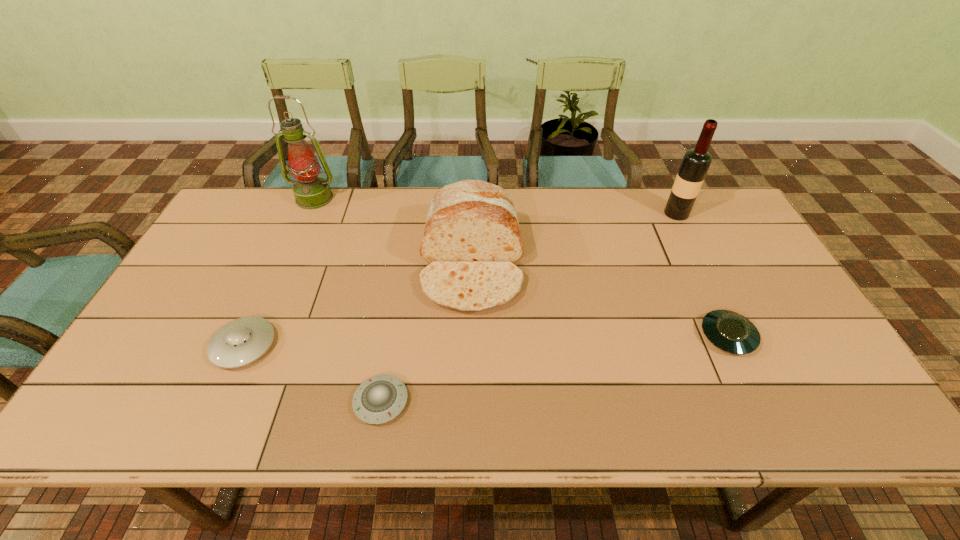
This screenshot has width=960, height=540. Find the location of `vacant space situated on the left of the leftmost saucer`. vacant space situated on the left of the leftmost saucer is located at coordinates (168, 345).

You are a GUI agent. You are given a task and a screenshot of the screen. Output one action in this format:
    pyautogui.click(x=<x>, y=<y>)
    Task: Click on the vacant space positioned on the left of the rightmost saucer
    Image resolution: width=960 pixels, height=540 pixels.
    Given the screenshot: What is the action you would take?
    pyautogui.click(x=601, y=336)

Where is `vacant space located on the left of the nearest saucer`? vacant space located on the left of the nearest saucer is located at coordinates (219, 401).

I want to click on oil lamp that is at the far edge, so click(x=311, y=191).

The width and height of the screenshot is (960, 540). Find the location of `wine bottle present at the far edge`. wine bottle present at the far edge is located at coordinates click(695, 163).

The image size is (960, 540). Identify the location of bread positioned at the far edge. (471, 239).

The image size is (960, 540). I want to click on object positioned at the near edge, so click(x=379, y=399).

What are the coordinates of `wine bottle at the right edge` in the screenshot? It's located at (695, 163).

I want to click on saucer that is positioned at the right edge, so click(x=731, y=332).

Locate an element on the screen. object at the far right corner is located at coordinates (695, 163).